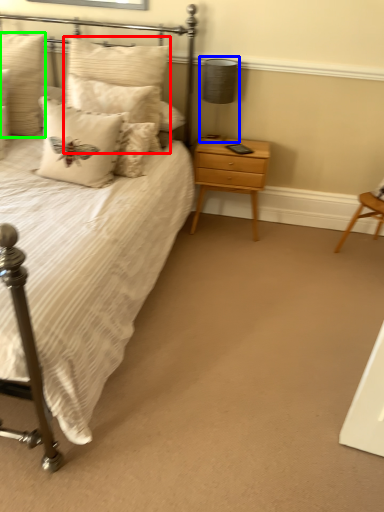
Question: Which is nearer to the pillow (highlighted by a red box)? table lamp (highlighted by a blue box) or pillow (highlighted by a green box).

Choices:
 (A) table lamp
 (B) pillow

Answer: (B)